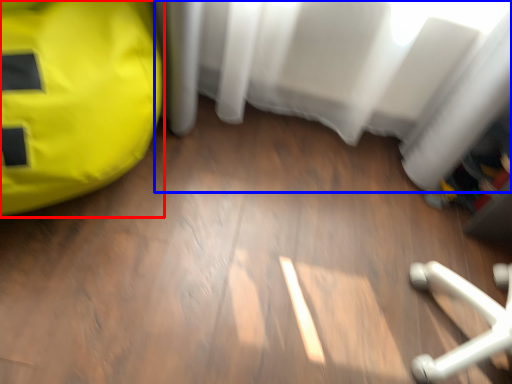
Question: Which of the following is the farthest to the observer, bean bag chair (highlighted by a red box) or curtain (highlighted by a blue box)?

Choices:
 (A) bean bag chair
 (B) curtain

Answer: (B)